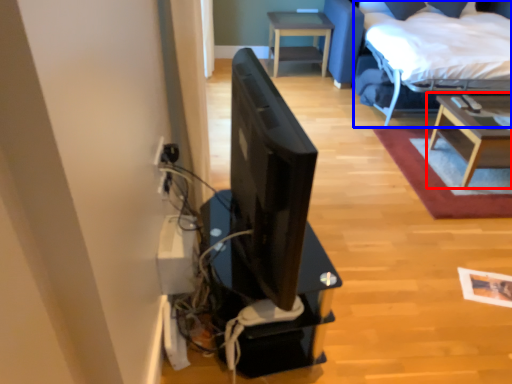
Question: Among these objects, which one is nearest to the camera, table (highlighted by a red box) or bed (highlighted by a blue box)?

Choices:
 (A) table
 (B) bed

Answer: (A)